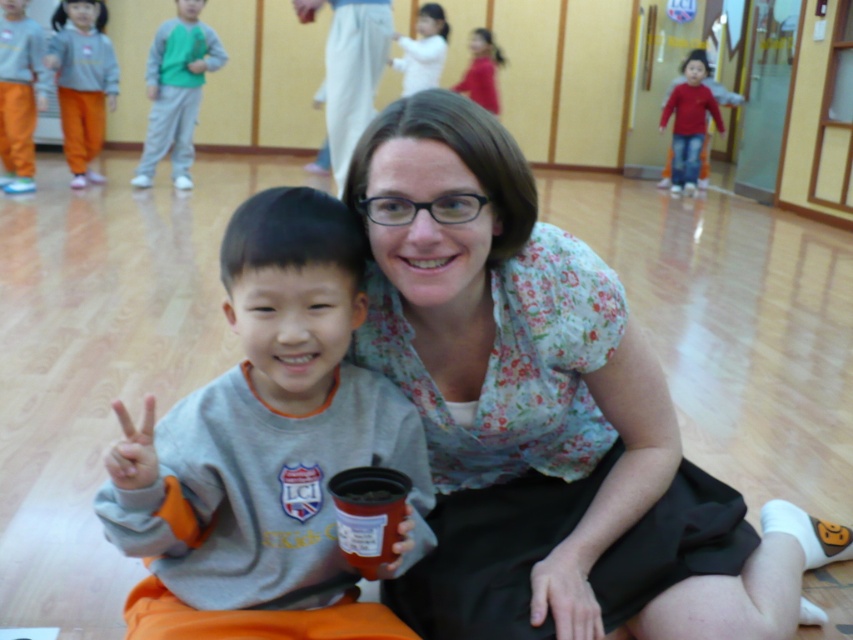
What are the coordinates of the orange cotton pants at left in the image?

The orange cotton pants at left are located at coordinates point (82, 81).

Based on the scene description, can you determine which clothing item is wider between the floral fabric blouse at center and the gray fleece sweatshirt at left?

The floral fabric blouse at center is wider than the gray fleece sweatshirt at left according to the description.

You are a fashion designer observing the image. You need to decide which item of clothing requires more fabric to make between the orange cotton pants at left and the white matte shirt at upper center. Which one would you choose?

The orange cotton pants at left is bigger than the white matte shirt at upper center, so it would require more fabric to make.